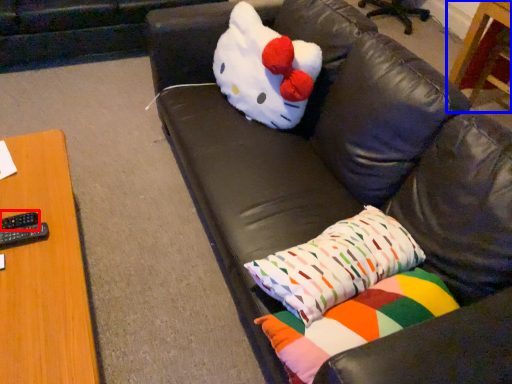
Question: Among these objects, which one is farthest to the camera, remote (highlighted by a red box) or table (highlighted by a blue box)?

Choices:
 (A) remote
 (B) table

Answer: (B)